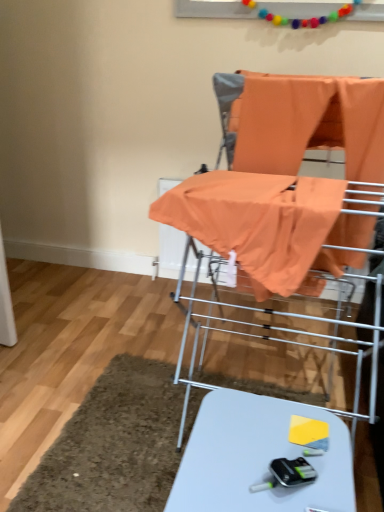
In order to click on vacant area on top of white glossy table at lower center (from a real-world perspective) in this screenshot , I will do `click(248, 454)`.